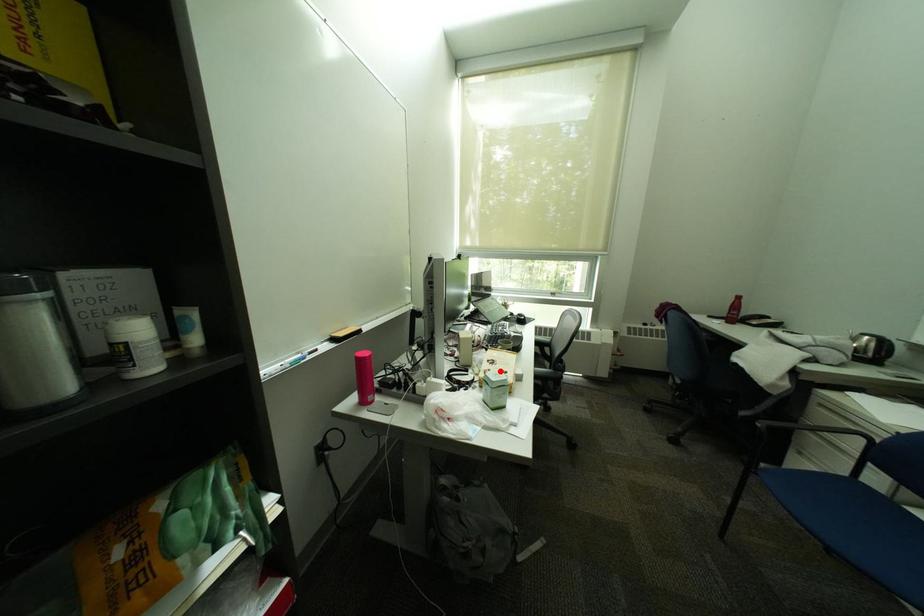
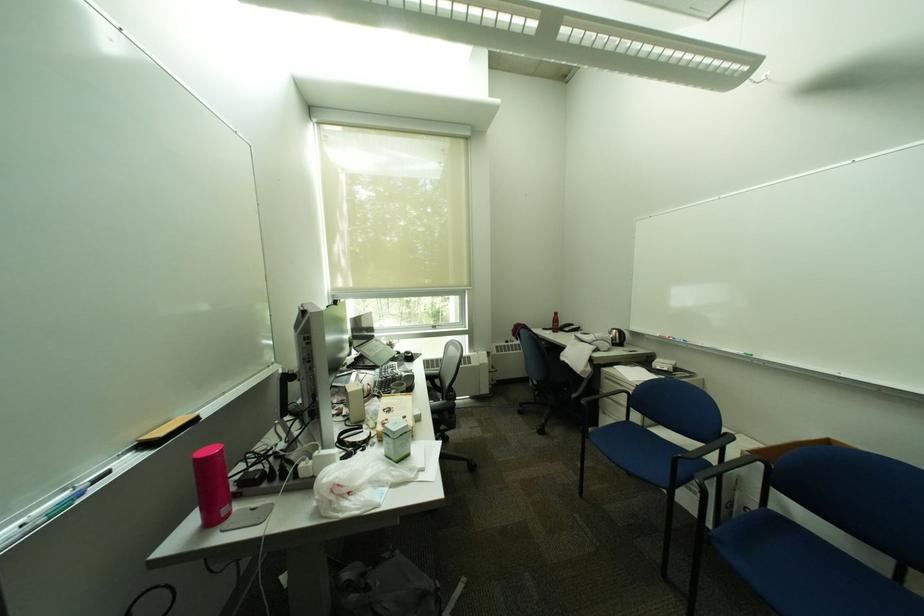
Locate, in the second image, the point that corresponds to the highlighted location in the first image.

(397, 421)